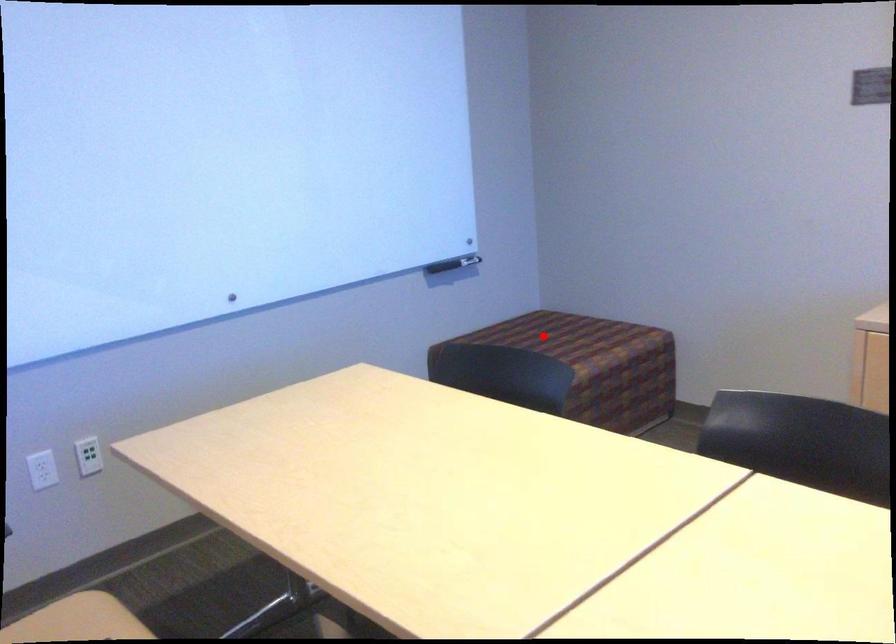
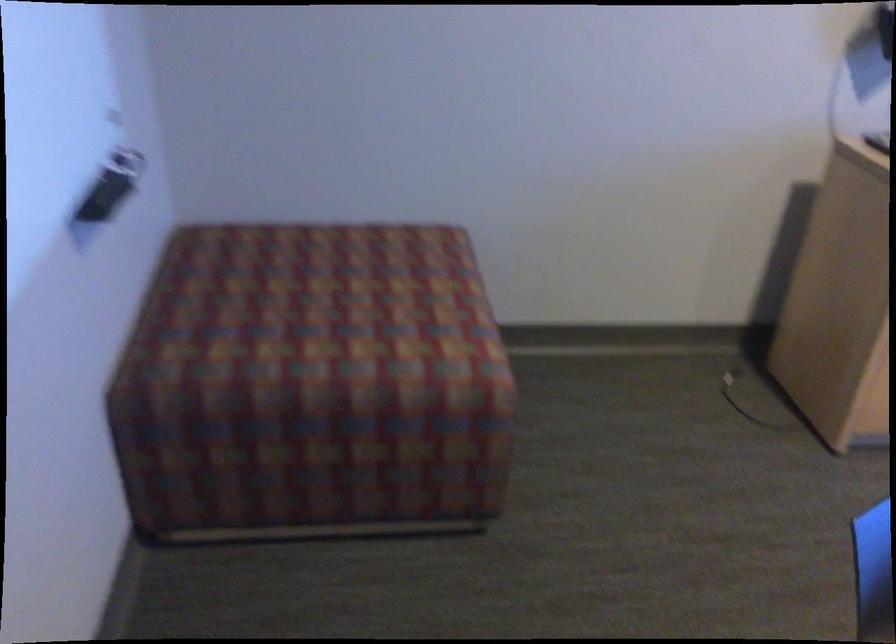
Question: I am providing you with two images of the same scene from different viewpoints. A red point is shown in image1. For the corresponding object point in image2, is it positioned nearer or farther from the camera?

Choices:
 (A) Nearer
 (B) Farther

Answer: (A)